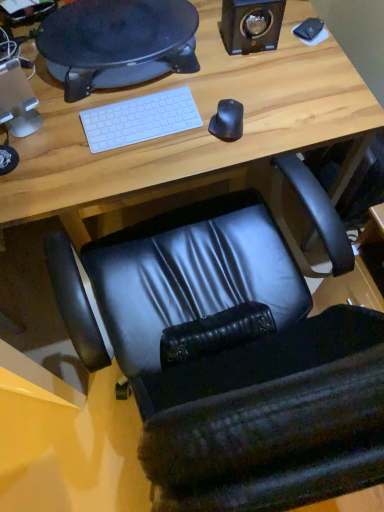
Question: Can you confirm if white matte keyboard at center is taller than black leather chair at center?

Choices:
 (A) yes
 (B) no

Answer: (B)

Question: Is white matte keyboard at center to the left of black leather chair at center from the viewer's perspective?

Choices:
 (A) no
 (B) yes

Answer: (B)

Question: Is white matte keyboard at center not close to black leather chair at center?

Choices:
 (A) no
 (B) yes

Answer: (A)

Question: Can you confirm if white matte keyboard at center is smaller than black leather chair at center?

Choices:
 (A) no
 (B) yes

Answer: (B)

Question: Considering the relative sizes of white matte keyboard at center and black leather chair at center in the image provided, is white matte keyboard at center wider than black leather chair at center?

Choices:
 (A) yes
 (B) no

Answer: (B)

Question: Choose the correct answer: Is black leather chair at center inside black rubber mouse at center or outside it?

Choices:
 (A) outside
 (B) inside

Answer: (A)

Question: From the image's perspective, is black leather chair at center positioned above or below black rubber mouse at center?

Choices:
 (A) above
 (B) below

Answer: (B)

Question: Is point 329,343 closer or farther from the camera than point 240,128?

Choices:
 (A) farther
 (B) closer

Answer: (B)

Question: From a real-world perspective, is black leather chair at center above or below black rubber mouse at center?

Choices:
 (A) below
 (B) above

Answer: (A)

Question: Considering the positions of white matte keyboard at center and black leather chair at center in the image, is white matte keyboard at center bigger or smaller than black leather chair at center?

Choices:
 (A) big
 (B) small

Answer: (B)

Question: Would you say white matte keyboard at center is to the left or to the right of black leather chair at center in the picture?

Choices:
 (A) right
 (B) left

Answer: (B)

Question: In the image, is white matte keyboard at center positioned in front of or behind black leather chair at center?

Choices:
 (A) front
 (B) behind

Answer: (B)

Question: Considering the positions of point (86, 126) and point (349, 348), is point (86, 126) closer or farther from the camera than point (349, 348)?

Choices:
 (A) closer
 (B) farther

Answer: (B)

Question: In terms of width, does black leather chair at center look wider or thinner when compared to white matte keyboard at center?

Choices:
 (A) thin
 (B) wide

Answer: (B)

Question: Is black leather chair at center in front of or behind white matte keyboard at center in the image?

Choices:
 (A) front
 (B) behind

Answer: (A)